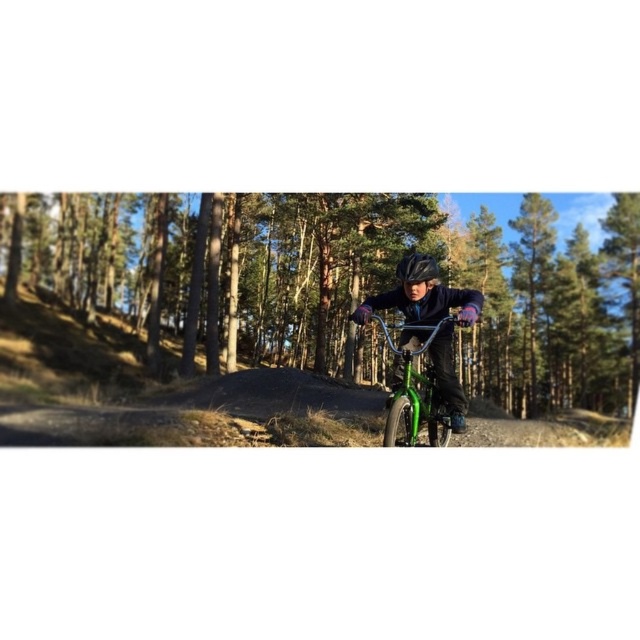
Between point (282, 234) and point (400, 388), which one is positioned behind?

Positioned behind is point (282, 234).

Image resolution: width=640 pixels, height=640 pixels. What do you see at coordinates (362, 282) in the screenshot?
I see `green metallic bicycle at center` at bounding box center [362, 282].

Identify the location of green metallic bicycle at center. (362, 282).